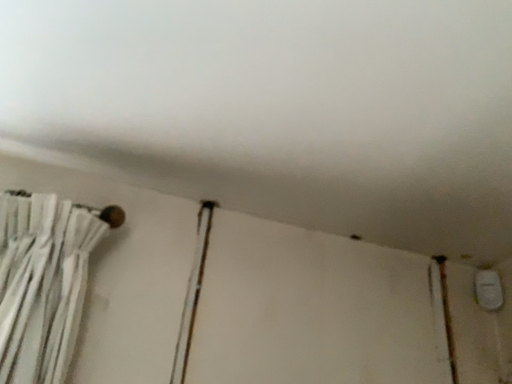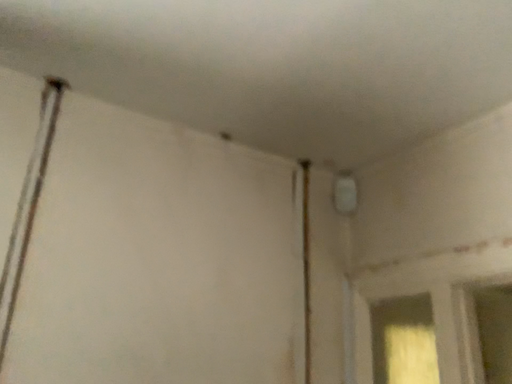
Question: Which way did the camera rotate in the video?

Choices:
 (A) rotated right
 (B) rotated left

Answer: (A)